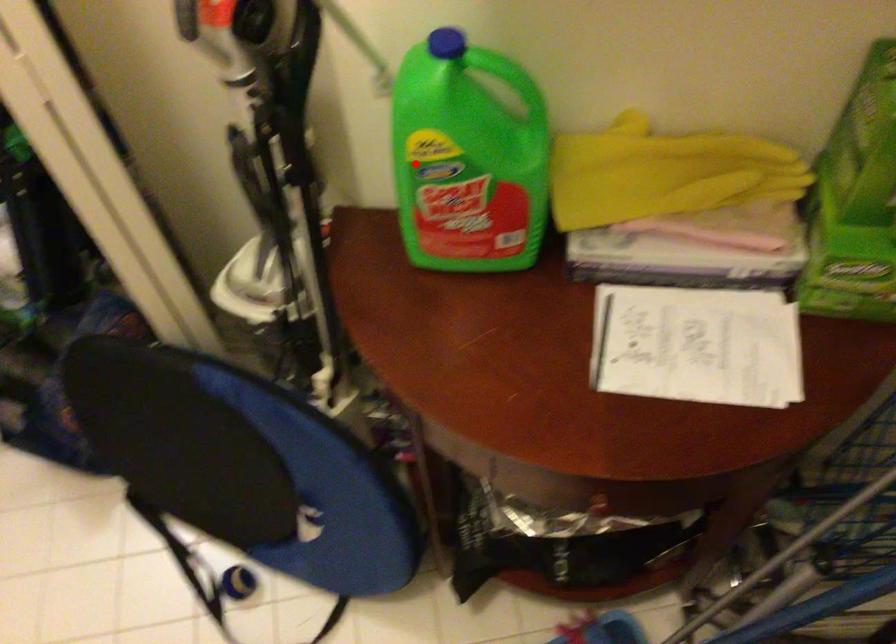
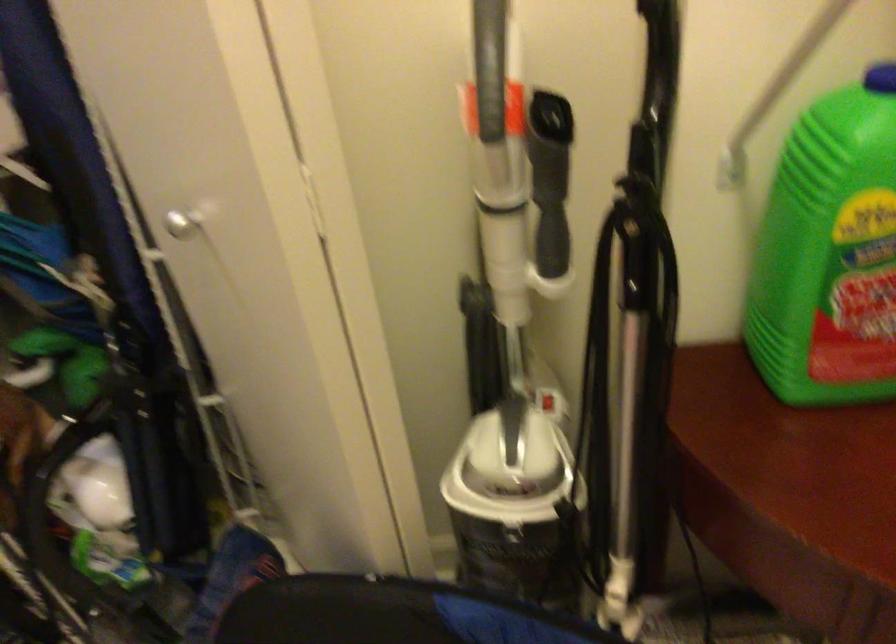
Question: I am providing you with two images of the same scene from different viewpoints. A red point is marked on the first image. Can you still see the location of the red point in image 2?

Choices:
 (A) Yes
 (B) No

Answer: (A)